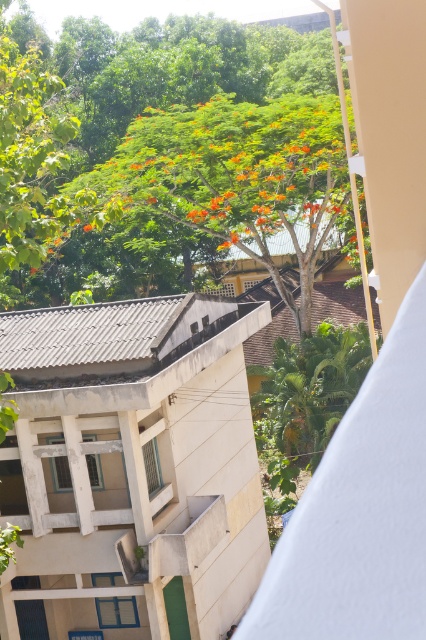
Question: Does white concrete balcony at center appear on the right side of green leafy tree at upper center?

Choices:
 (A) yes
 (B) no

Answer: (B)

Question: Which object is closer to the camera taking this photo?

Choices:
 (A) green leafy tree at upper center
 (B) white concrete balcony at center

Answer: (A)

Question: Does white concrete balcony at center appear on the left side of green leafy tree at upper center?

Choices:
 (A) yes
 (B) no

Answer: (A)

Question: Can you confirm if white concrete balcony at center is wider than green leafy tree at upper center?

Choices:
 (A) no
 (B) yes

Answer: (A)